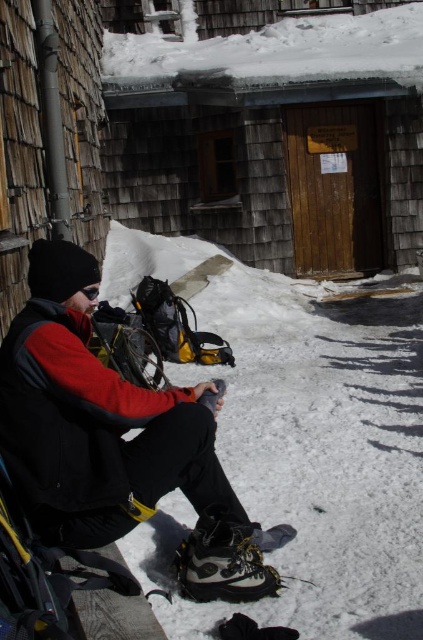
Is matte black jacket at center taller than camouflage fabric ski boot at lower center?

Yes, matte black jacket at center is taller than camouflage fabric ski boot at lower center.

Is matte black jacket at center thinner than camouflage fabric ski boot at lower center?

No.

Which is in front, point (32, 440) or point (191, 582)?

Positioned in front is point (32, 440).

Locate an element on the screen. matte black jacket at center is located at coordinates (112, 438).

Can you confirm if wooden cabin at center is wider than camouflage fabric ski boot at lower center?

Correct, the width of wooden cabin at center exceeds that of camouflage fabric ski boot at lower center.

Identify the location of wooden cabin at center. The image size is (423, 640). (274, 134).

The image size is (423, 640). I want to click on wooden cabin at center, so click(274, 134).

Does point (310, 13) come farther from viewer compared to point (95, 285)?

Yes, it is.

Describe the element at coordinates (274, 134) in the screenshot. I see `wooden cabin at center` at that location.

Locate an element on the screen. Image resolution: width=423 pixels, height=640 pixels. wooden cabin at center is located at coordinates (274, 134).